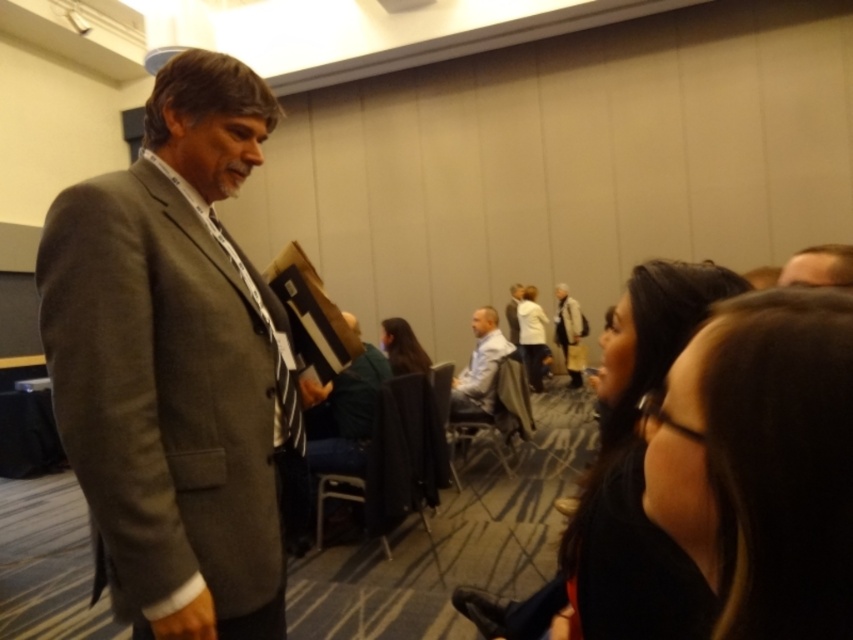
Can you confirm if matte black tie at center is positioned to the right of light brown hair at upper right?

Incorrect, matte black tie at center is not on the right side of light brown hair at upper right.

Which is behind, point (282, 436) or point (840, 269)?

The point (282, 436) is more distant.

Identify the location of matte black tie at center. (273, 353).

Looking at this image, measure the distance from black fabric chair at center to light blue shirt at center.

The distance of black fabric chair at center from light blue shirt at center is 1.21 meters.

Which is below, black fabric chair at center or light blue shirt at center?

black fabric chair at center

Locate an element on the screen. This screenshot has width=853, height=640. black fabric chair at center is located at coordinates (393, 460).

At what (x,y) coordinates should I click in order to perform the action: click on black fabric chair at center. Please return your answer as a coordinate pair (x, y). Looking at the image, I should click on (393, 460).

Based on the photo, who is taller, light brown hair at upper right or light gray suit at center?

light gray suit at center is taller.

Can you confirm if light brown hair at upper right is positioned to the left of light gray suit at center?

Indeed, light brown hair at upper right is positioned on the left side of light gray suit at center.

The image size is (853, 640). Describe the element at coordinates (819, 266) in the screenshot. I see `light brown hair at upper right` at that location.

Identify the location of light brown hair at upper right. The width and height of the screenshot is (853, 640). (819, 266).